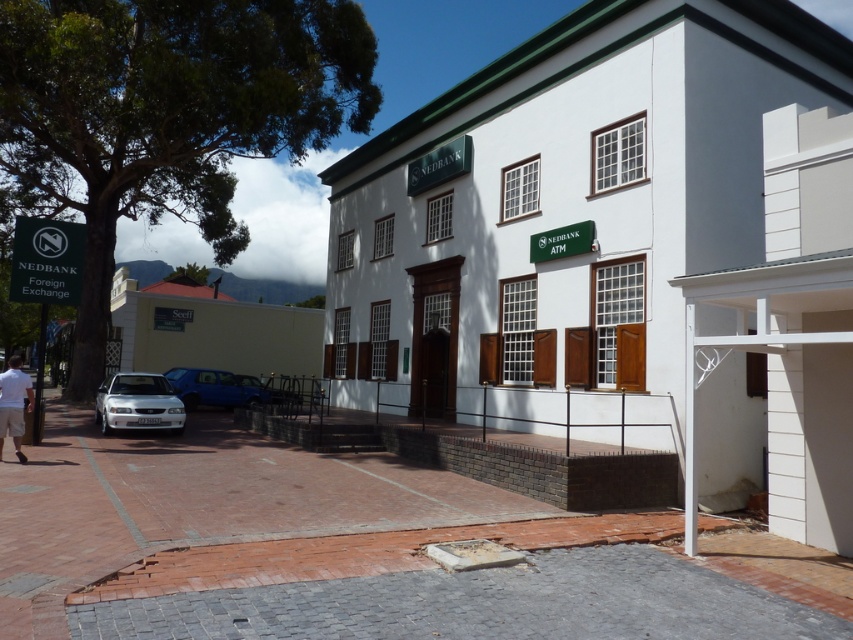
How distant is white matte sedan at lower left from metallic blue van at center?

6.73 meters

Which is below, white matte sedan at lower left or metallic blue van at center?

Positioned lower is metallic blue van at center.

At what (x,y) coordinates should I click in order to perform the action: click on white matte sedan at lower left. Please return your answer as a coordinate pair (x, y). Looking at the image, I should click on (137, 403).

Measure the distance from white matte sedan at lower left to light brown shorts at lower left.

15.49 feet

Is point (103, 420) positioned after point (15, 355)?

No, it is in front of (15, 355).

You are a GUI agent. You are given a task and a screenshot of the screen. Output one action in this format:
    pyautogui.click(x=<x>, y=<y>)
    Task: Click on the white matte sedan at lower left
    Image resolution: width=853 pixels, height=640 pixels.
    Given the screenshot: What is the action you would take?
    coord(137,403)

In the scene shown: Between metallic blue van at center and light brown shorts at lower left, which one has less height?

Standing shorter between the two is light brown shorts at lower left.

In the scene shown: Can you confirm if metallic blue van at center is thinner than light brown shorts at lower left?

No.

Which is behind, point (195, 381) or point (3, 387)?

Point (195, 381)

Where is `metallic blue van at center`? The image size is (853, 640). metallic blue van at center is located at coordinates (218, 387).